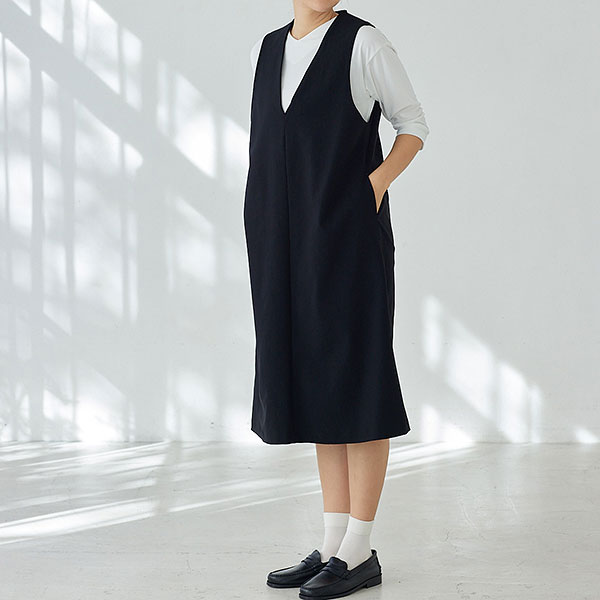
The image size is (600, 600). What are the coordinates of `shadows on the back wall` in the screenshot? It's located at (108, 342), (156, 300), (155, 158), (85, 83).